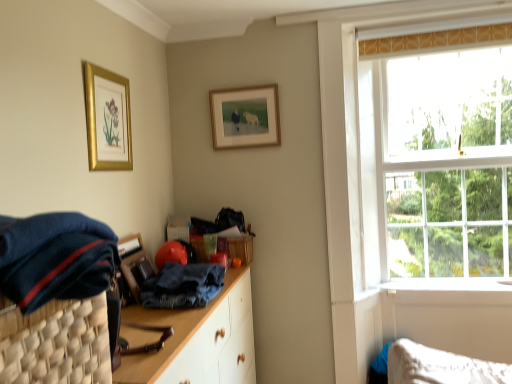
Question: Could you tell me if clear glass window at upper right is turned towards gold metallic picture frame at upper left, which is counted as the second picture frame, starting from the back?

Choices:
 (A) no
 (B) yes

Answer: (A)

Question: Considering the relative sizes of clear glass window at upper right and gold metallic picture frame at upper left, the first picture frame viewed from the front, in the image provided, is clear glass window at upper right bigger than gold metallic picture frame at upper left, the first picture frame viewed from the front,?

Choices:
 (A) yes
 (B) no

Answer: (A)

Question: From a real-world perspective, is clear glass window at upper right located higher than gold metallic picture frame at upper left, which is the 1th picture frame from left to right?

Choices:
 (A) no
 (B) yes

Answer: (A)

Question: Is clear glass window at upper right wider than gold metallic picture frame at upper left, the second picture frame positioned from the right?

Choices:
 (A) yes
 (B) no

Answer: (A)

Question: Is clear glass window at upper right outside gold metallic picture frame at upper left, the second picture frame positioned from the right?

Choices:
 (A) no
 (B) yes

Answer: (B)

Question: Considering the positions of denim at center, positioned as the 2th clothing in top-to-bottom order, and dark blue fabric at left, positioned as the first clothing in front-to-back order, in the image, is denim at center, positioned as the 2th clothing in top-to-bottom order, bigger or smaller than dark blue fabric at left, positioned as the first clothing in front-to-back order,?

Choices:
 (A) small
 (B) big

Answer: (A)

Question: Is denim at center, positioned as the second clothing in front-to-back order, inside the boundaries of dark blue fabric at left, which is counted as the 2th clothing, starting from the bottom, or outside?

Choices:
 (A) inside
 (B) outside

Answer: (B)

Question: From a real-world perspective, relative to dark blue fabric at left, which is counted as the 2th clothing, starting from the bottom, is denim at center, positioned as the second clothing in front-to-back order, vertically above or below?

Choices:
 (A) below
 (B) above

Answer: (A)

Question: Considering the positions of denim at center, which ranks as the 1th clothing in back-to-front order, and dark blue fabric at left, which is the 1th clothing in top-to-bottom order, in the image, is denim at center, which ranks as the 1th clothing in back-to-front order, wider or thinner than dark blue fabric at left, which is the 1th clothing in top-to-bottom order,?

Choices:
 (A) thin
 (B) wide

Answer: (A)

Question: Considering the positions of gold-framed picture at upper center, placed as the second picture frame when sorted from left to right, and denim at center, positioned as the 2th clothing in top-to-bottom order, in the image, is gold-framed picture at upper center, placed as the second picture frame when sorted from left to right, bigger or smaller than denim at center, positioned as the 2th clothing in top-to-bottom order,?

Choices:
 (A) big
 (B) small

Answer: (B)

Question: From the image's perspective, is gold-framed picture at upper center, arranged as the 2th picture frame when viewed from the front, located above or below denim at center, which is the 1th clothing in bottom-to-top order?

Choices:
 (A) above
 (B) below

Answer: (A)

Question: Considering the positions of gold-framed picture at upper center, placed as the second picture frame when sorted from left to right, and denim at center, positioned as the 2th clothing in top-to-bottom order, in the image, is gold-framed picture at upper center, placed as the second picture frame when sorted from left to right, wider or thinner than denim at center, positioned as the 2th clothing in top-to-bottom order,?

Choices:
 (A) wide
 (B) thin

Answer: (B)

Question: Is gold-framed picture at upper center, arranged as the 1th picture frame when viewed from the right, taller or shorter than denim at center, positioned as the 2th clothing in top-to-bottom order?

Choices:
 (A) tall
 (B) short

Answer: (A)

Question: Considering their positions, is gold metallic picture frame at upper left, the first picture frame viewed from the front, located in front of or behind dark blue woven basket at left?

Choices:
 (A) front
 (B) behind

Answer: (B)

Question: Visually, is gold metallic picture frame at upper left, the first picture frame viewed from the front, positioned to the left or to the right of dark blue woven basket at left?

Choices:
 (A) left
 (B) right

Answer: (A)